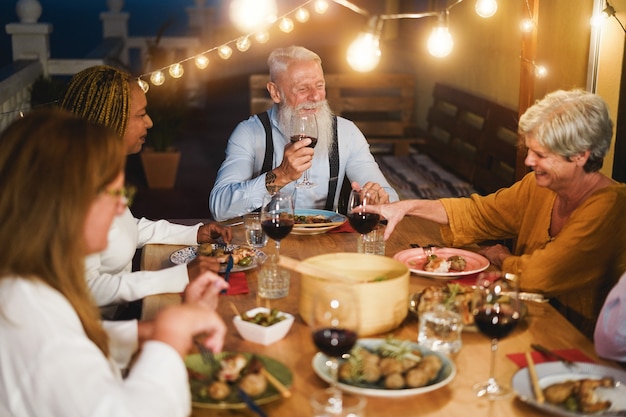
Locate an element on the screen. wine glasses is located at coordinates (365, 205), (300, 120), (278, 215), (341, 331), (504, 301).